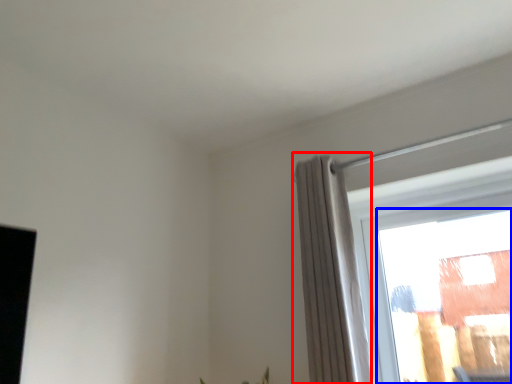
Question: Among these objects, which one is farthest to the camera, curtain (highlighted by a red box) or window (highlighted by a blue box)?

Choices:
 (A) curtain
 (B) window

Answer: (B)